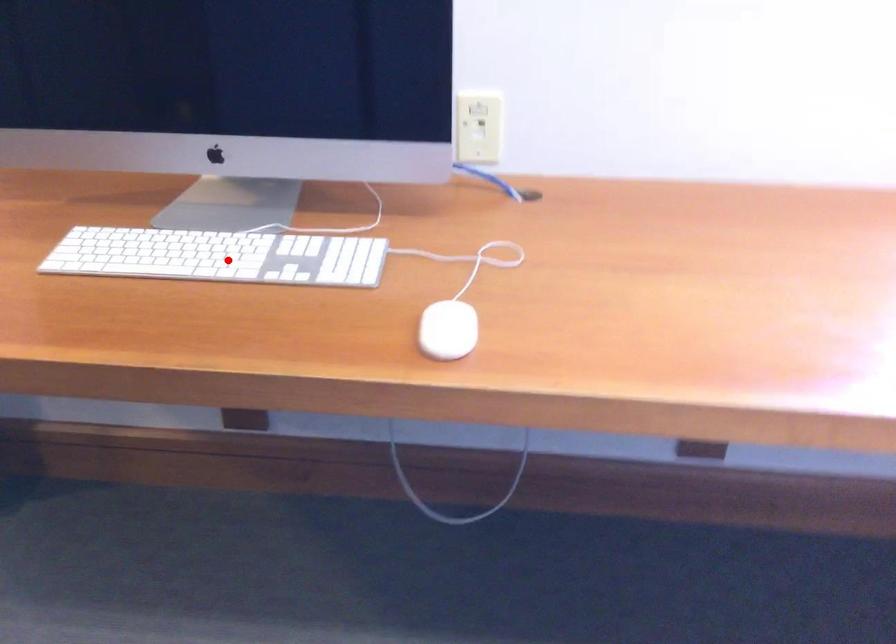
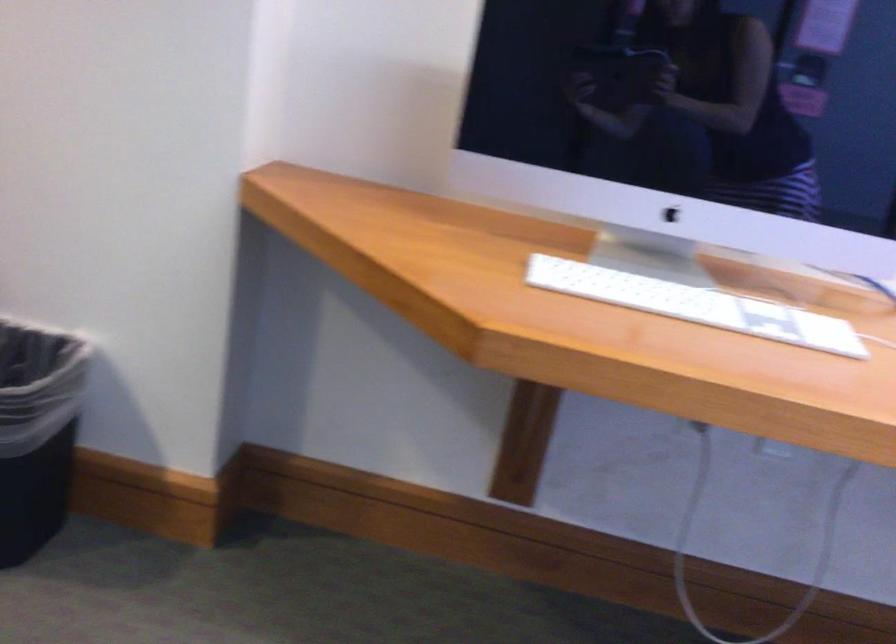
Find the pixel in the second image that matches the highlighted location in the first image.

(695, 305)